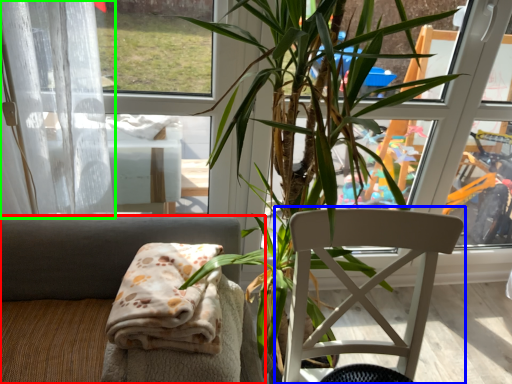
Question: Which is nearer to the chair (highlighted by a red box)? chair (highlighted by a blue box) or curtain (highlighted by a green box).

Choices:
 (A) chair
 (B) curtain

Answer: (B)